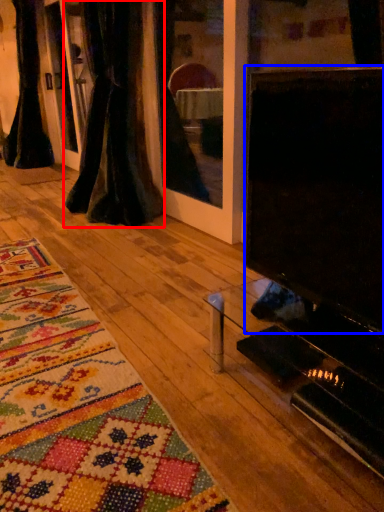
Question: Which object appears closest to the camera in this image, curtain (highlighted by a red box) or screen (highlighted by a blue box)?

Choices:
 (A) curtain
 (B) screen

Answer: (B)